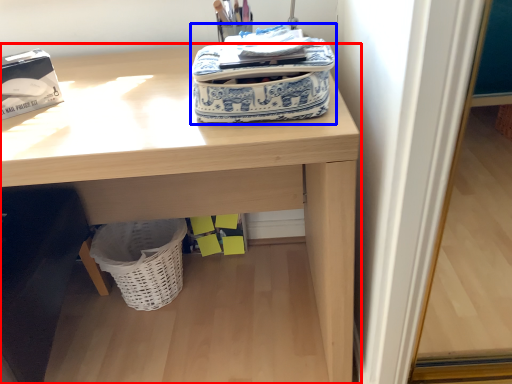
Question: Which object is closer to the camera taking this photo, desk (highlighted by a red box) or bag (highlighted by a blue box)?

Choices:
 (A) desk
 (B) bag

Answer: (B)